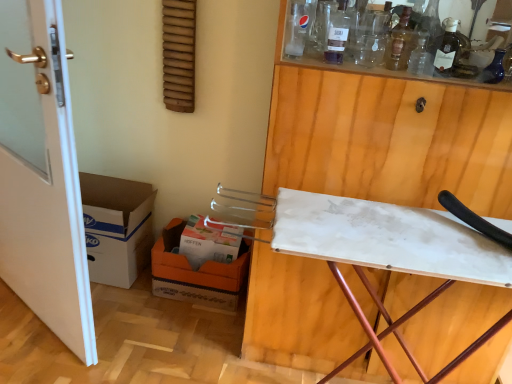
The width and height of the screenshot is (512, 384). What are the coordinates of `blank space situated above white matte ironing board at lower right (from a real-world perspective)` in the screenshot? It's located at (379, 226).